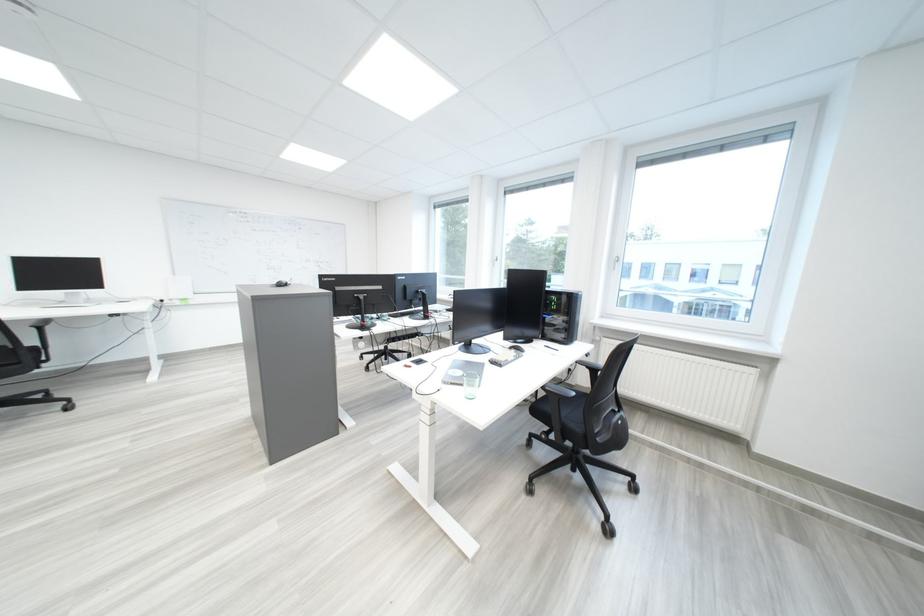
Locate an element on the screen. black chair armrest is located at coordinates (558, 390).